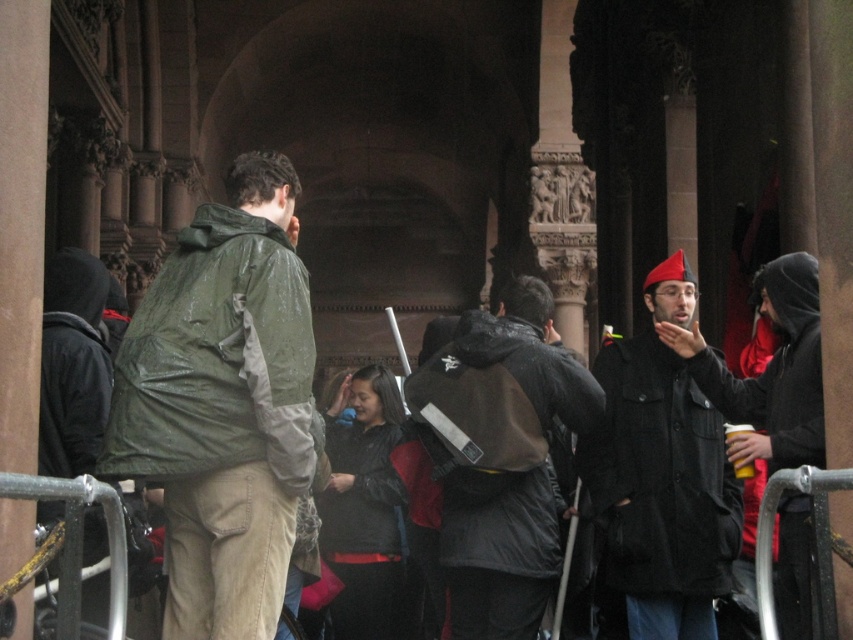
Question: Based on their relative distances, which object is nearer to the dark gray matte jacket at center?

Choices:
 (A) black woolen jacket at center-right
 (B) green matte jacket at left

Answer: (A)

Question: Is green matte jacket at left bigger than black matte jacket at center?

Choices:
 (A) no
 (B) yes

Answer: (B)

Question: Estimate the real-world distances between objects in this image. Which object is closer to the dark gray matte jacket at center?

Choices:
 (A) black matte jacket at center
 (B) green matte jacket at left

Answer: (A)

Question: Does dark gray matte jacket at center have a greater width compared to matte black jacket at right?

Choices:
 (A) yes
 (B) no

Answer: (A)

Question: Estimate the real-world distances between objects in this image. Which object is closer to the dark gray matte jacket at center?

Choices:
 (A) green matte jacket at left
 (B) matte black jacket at right
 (C) black woolen jacket at center-right
 (D) black matte jacket at center

Answer: (C)

Question: Does dark gray matte jacket at center have a lesser width compared to matte black jacket at right?

Choices:
 (A) no
 (B) yes

Answer: (A)